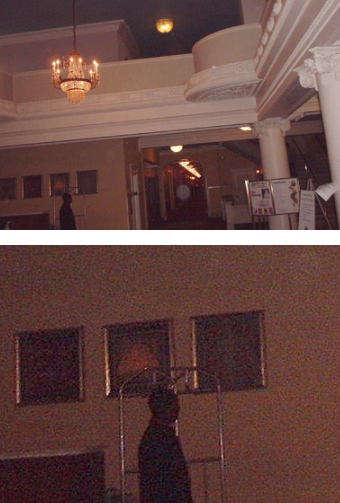
Where is `photos`? photos is located at coordinates (134, 46), (121, 275).